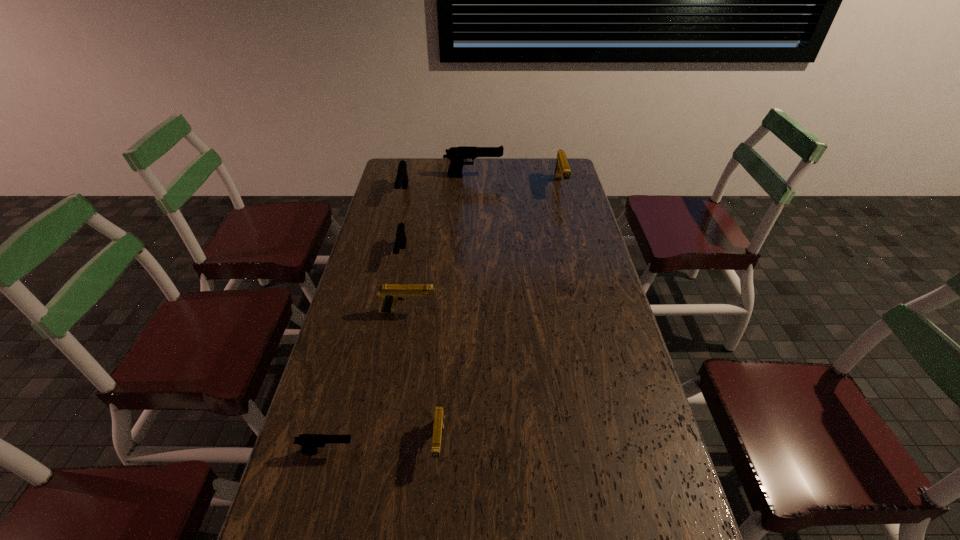
Where is `object located at the far left corner`? This screenshot has height=540, width=960. object located at the far left corner is located at coordinates (402, 177).

The height and width of the screenshot is (540, 960). What are the coordinates of `object located in the far right corner section of the desktop` in the screenshot? It's located at (562, 169).

Where is `free space at the far edge of the desktop`? This screenshot has height=540, width=960. free space at the far edge of the desktop is located at coordinates (429, 183).

Image resolution: width=960 pixels, height=540 pixels. I want to click on vacant space at the left edge of the desktop, so click(x=407, y=193).

Locate an element on the screen. vacant space at the right edge is located at coordinates (577, 198).

Where is `vacant region at the far right corner of the desktop`? Image resolution: width=960 pixels, height=540 pixels. vacant region at the far right corner of the desktop is located at coordinates click(x=553, y=168).

Locate an element on the screen. vacant space in between the smallest black pistol and the rightmost object is located at coordinates (444, 320).

Identify the location of vacant point located between the nearest black pistol and the fourth farthest object. (365, 353).

What are the coordinates of `empty space that is in between the farthest tan pistol and the fourth farthest pistol` in the screenshot? It's located at (481, 221).

In order to click on free space between the smallest black pistol and the leftmost tan pistol in this screenshot , I will do `click(368, 382)`.